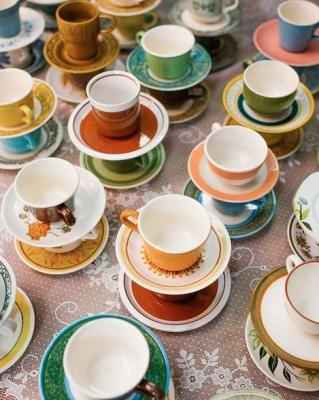
Locate an element on the screen. yellow cups and mugs is located at coordinates (78, 47), (119, 3), (175, 264), (12, 118).